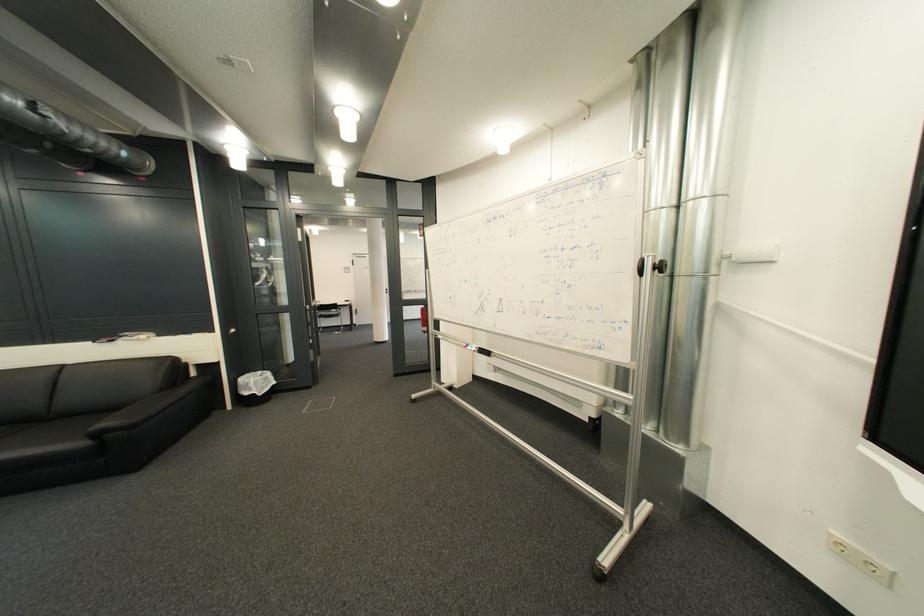
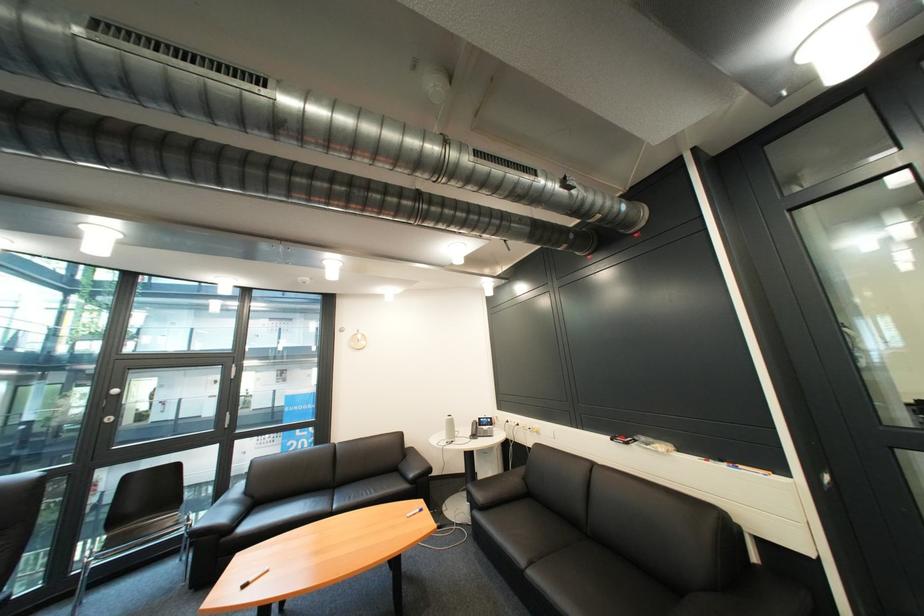
Locate, in the second image, the point that corresponds to (x=198, y=338) in the first image.

(736, 468)